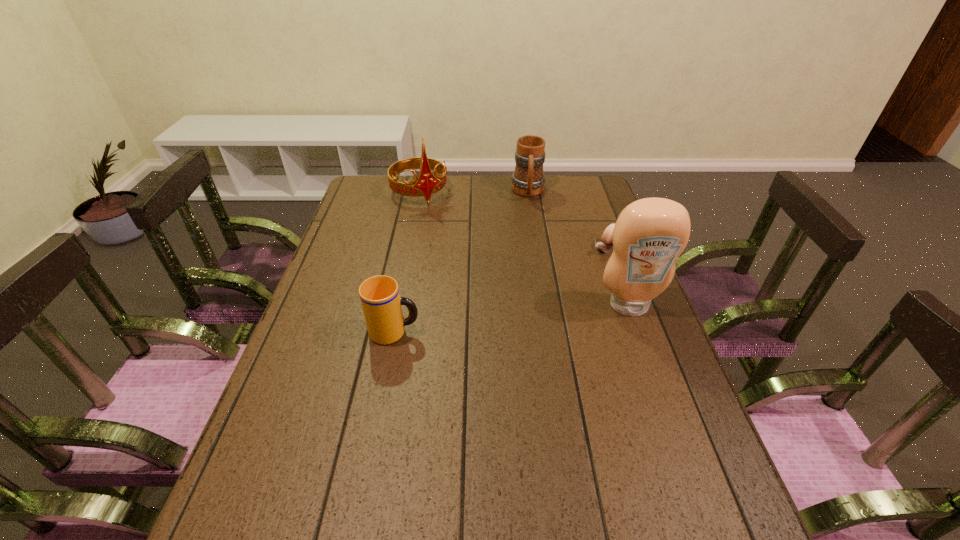
The height and width of the screenshot is (540, 960). What are the coordinates of `vacant space on the desktop that is between the cup and the condiment and is positioned on the side of the mug with the handle` in the screenshot? It's located at (536, 316).

This screenshot has width=960, height=540. I want to click on free spot on the desktop that is between the fourth tallest object and the tallest object and is positioned on the front-facing side of the escargot, so click(x=512, y=319).

I want to click on vacant spot on the desktop that is between the cup and the tallest object and is positioned on the front-facing side of the second tallest object, so click(x=505, y=320).